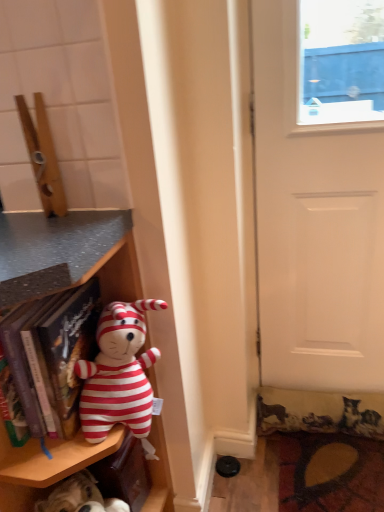
Question: Is fluffy carpet at lower right turned away from matte plastic shelf at left?

Choices:
 (A) yes
 (B) no

Answer: (B)

Question: Considering the relative sizes of fluffy carpet at lower right and matte plastic shelf at left in the image provided, is fluffy carpet at lower right thinner than matte plastic shelf at left?

Choices:
 (A) yes
 (B) no

Answer: (A)

Question: Does fluffy carpet at lower right have a smaller size compared to matte plastic shelf at left?

Choices:
 (A) yes
 (B) no

Answer: (A)

Question: From a real-world perspective, is fluffy carpet at lower right under matte plastic shelf at left?

Choices:
 (A) yes
 (B) no

Answer: (A)

Question: Can you confirm if fluffy carpet at lower right is shorter than matte plastic shelf at left?

Choices:
 (A) no
 (B) yes

Answer: (B)

Question: Is fluffy carpet at lower right to the left of matte plastic shelf at left from the viewer's perspective?

Choices:
 (A) no
 (B) yes

Answer: (A)

Question: Is fluffy carpet at lower right facing towards white matte door at right?

Choices:
 (A) no
 (B) yes

Answer: (A)

Question: Does fluffy carpet at lower right have a lesser height compared to white matte door at right?

Choices:
 (A) no
 (B) yes

Answer: (B)

Question: From the image's perspective, is fluffy carpet at lower right beneath white matte door at right?

Choices:
 (A) no
 (B) yes

Answer: (B)

Question: Is fluffy carpet at lower right at the right side of white matte door at right?

Choices:
 (A) no
 (B) yes

Answer: (A)

Question: Is fluffy carpet at lower right wider than white matte door at right?

Choices:
 (A) yes
 (B) no

Answer: (A)

Question: Are fluffy carpet at lower right and white matte door at right located far from each other?

Choices:
 (A) no
 (B) yes

Answer: (A)

Question: Considering the relative sizes of white matte door at right and striped fabric plush toy at left in the image provided, is white matte door at right bigger than striped fabric plush toy at left?

Choices:
 (A) no
 (B) yes

Answer: (B)